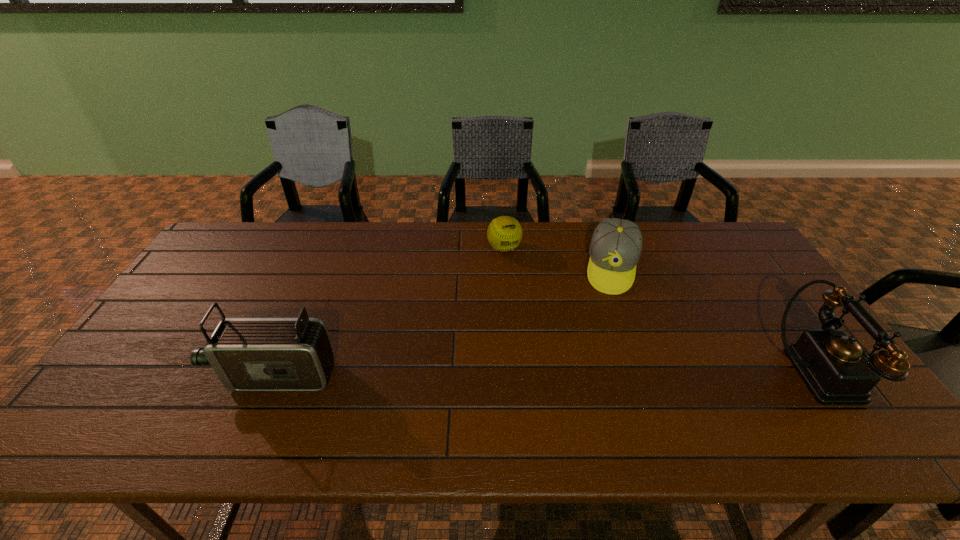
At what (x,y) coordinates should I click in order to perform the action: click on object positioned at the near right corner. Please return your answer as a coordinate pair (x, y). The height and width of the screenshot is (540, 960). Looking at the image, I should click on (838, 370).

The image size is (960, 540). I want to click on free point at the far edge, so click(519, 252).

In order to click on free spot at the near edge of the desktop in this screenshot , I will do `click(727, 387)`.

The image size is (960, 540). In the image, there is a desktop. In order to click on vacant space at the right edge in this screenshot , I will do pos(756,289).

Where is `free spot between the baseball cap and the rightmost object`? Image resolution: width=960 pixels, height=540 pixels. free spot between the baseball cap and the rightmost object is located at coordinates (713, 320).

You are a GUI agent. You are given a task and a screenshot of the screen. Output one action in this format:
    pyautogui.click(x=<x>, y=<y>)
    Task: Click on the free spot between the camcorder and the baseball cap
    This screenshot has width=960, height=540.
    Given the screenshot: What is the action you would take?
    pyautogui.click(x=444, y=322)

Locate an element on the screen. Image resolution: width=960 pixels, height=540 pixels. vacant area between the second shortest object and the softball is located at coordinates (558, 258).

Locate an element on the screen. This screenshot has width=960, height=540. blank region between the leftmost object and the telephone is located at coordinates (545, 374).

The image size is (960, 540). I want to click on vacant point located between the softball and the telephone, so click(x=660, y=310).

Where is `empty space between the rightmost object and the second object from left to right`? empty space between the rightmost object and the second object from left to right is located at coordinates (660, 310).